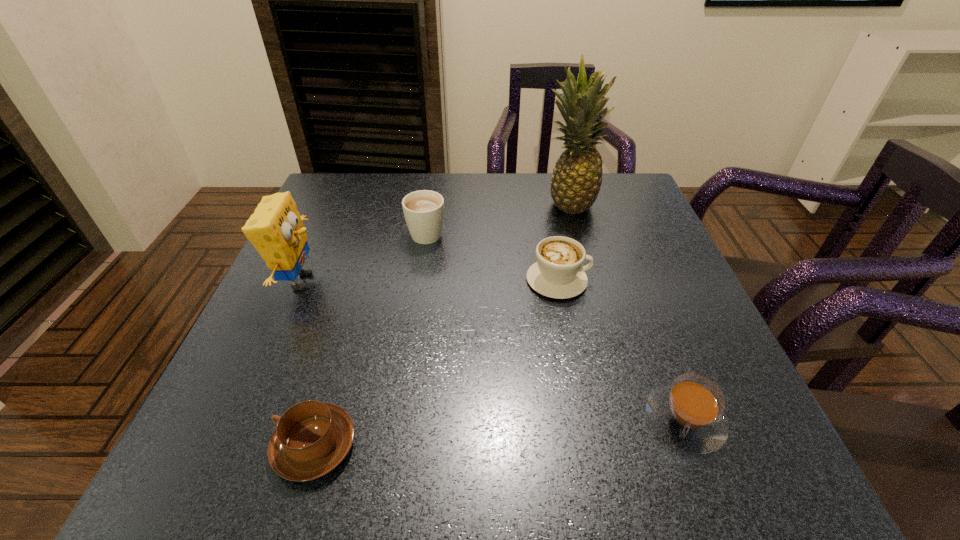
Locate an element on the screen. This screenshot has width=960, height=540. pineapple present at the right edge is located at coordinates (x=577, y=177).

Find the location of a particular element. This screenshot has height=540, width=960. cappuccino positioned at the right edge is located at coordinates (688, 413).

This screenshot has width=960, height=540. In order to click on object present at the near left corner in this screenshot , I will do `click(312, 438)`.

Locate an element on the screen. The height and width of the screenshot is (540, 960). object present at the far right corner is located at coordinates (577, 177).

Identify the location of object that is at the near right corner. The image size is (960, 540). (688, 413).

Locate an element on the screen. The height and width of the screenshot is (540, 960). blank space at the far edge of the desktop is located at coordinates (397, 181).

The height and width of the screenshot is (540, 960). Find the location of `vacant space at the near edge of the desktop`. vacant space at the near edge of the desktop is located at coordinates (534, 438).

Where is `free spot at the right edge of the desktop`? The width and height of the screenshot is (960, 540). free spot at the right edge of the desktop is located at coordinates (660, 235).

The image size is (960, 540). Find the location of `vacant space at the far left corner`. vacant space at the far left corner is located at coordinates (336, 208).

At what (x,y) coordinates should I click in order to perform the action: click on free space at the near left corner. Please return your answer as a coordinate pair (x, y). The height and width of the screenshot is (540, 960). Looking at the image, I should click on (241, 451).